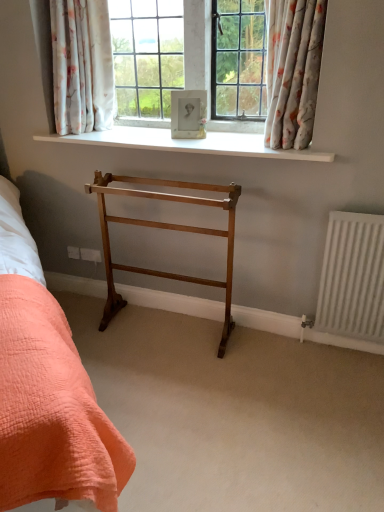
Find the location of `free space above white smooth window sill at upper center (from a real-world perspective)`. free space above white smooth window sill at upper center (from a real-world perspective) is located at coordinates (184, 136).